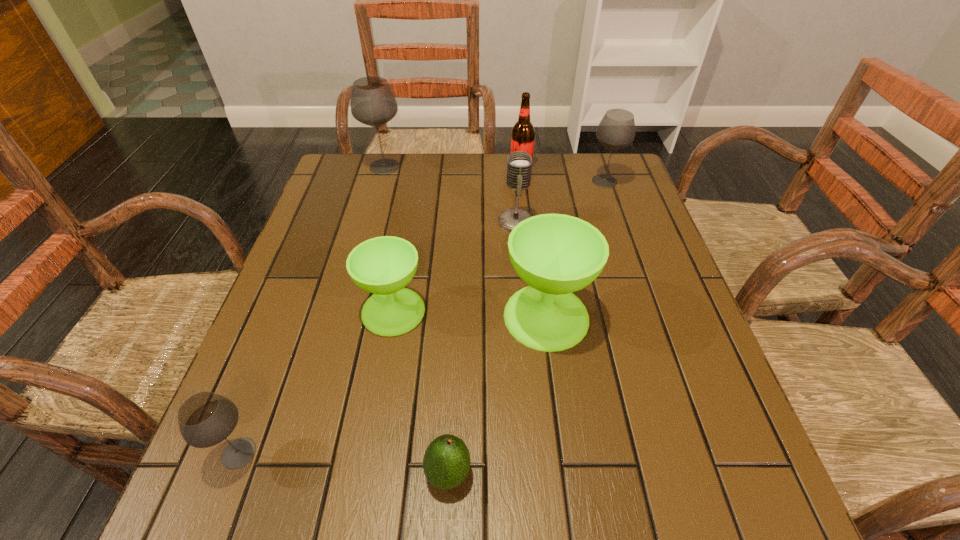
Find the location of a particular element. The width and height of the screenshot is (960, 540). vacant area that lies between the gray microphone and the rightmost gray wineglass is located at coordinates (560, 201).

Where is `vacant space that is in between the biggest gray wineglass and the second wineglass from right to left`? The image size is (960, 540). vacant space that is in between the biggest gray wineglass and the second wineglass from right to left is located at coordinates pos(466,241).

Locate an element on the screen. This screenshot has height=540, width=960. free point between the microphone and the second gray wineglass from left to right is located at coordinates (x=450, y=194).

At what (x,y) coordinates should I click in order to perform the action: click on object that stands as the third closest to the gray microphone. Please return your answer as a coordinate pair (x, y). The height and width of the screenshot is (540, 960). Looking at the image, I should click on (616, 130).

Select which object is the fifth closest to the fifth object from right to left. Please provide its 2D coordinates. Your answer should be formatted as a tuple, i.e. [(x, y)], where the tuple contains the x and y coordinates of a point satisfying the conditions above.

[(616, 130)]

Point out which wineglass is positioned as the third nearest to the bigger green wineglass. Please provide its 2D coordinates. Your answer should be formatted as a tuple, i.e. [(x, y)], where the tuple contains the x and y coordinates of a point satisfying the conditions above.

[(205, 419)]

Identify which wineglass is the fifth nearest to the root beer. Please provide its 2D coordinates. Your answer should be formatted as a tuple, i.e. [(x, y)], where the tuple contains the x and y coordinates of a point satisfying the conditions above.

[(205, 419)]

At what (x,y) coordinates should I click in order to perform the action: click on the third closest gray wineglass relative to the root beer. Please return your answer as a coordinate pair (x, y). Looking at the image, I should click on (205, 419).

Identify which gray wineglass is located as the second nearest to the root beer. Please provide its 2D coordinates. Your answer should be formatted as a tuple, i.e. [(x, y)], where the tuple contains the x and y coordinates of a point satisfying the conditions above.

[(372, 103)]

The width and height of the screenshot is (960, 540). I want to click on free space that satisfies the following two spatial constraints: 1. on the back side of the second gray wineglass from left to right; 2. on the left side of the leftmost wineglass, so click(x=348, y=167).